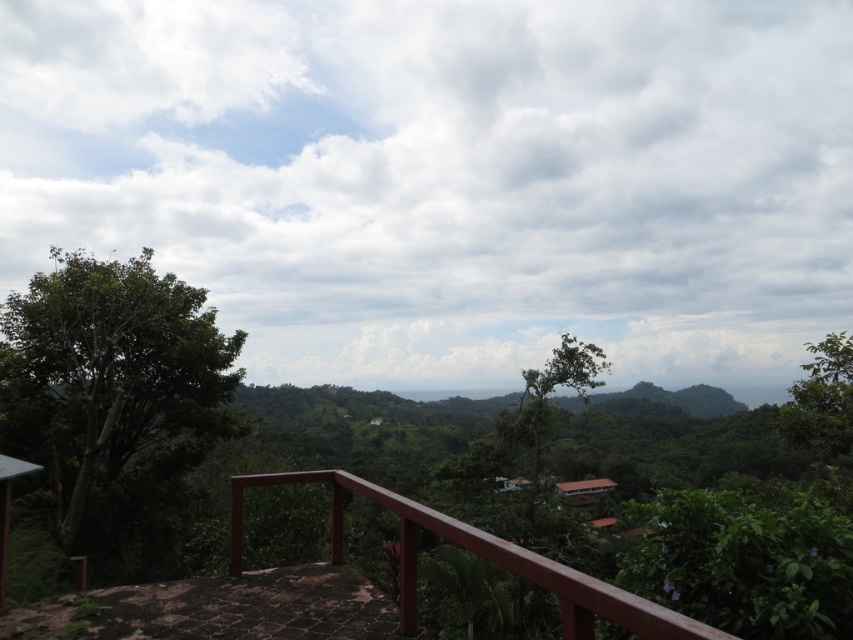
Question: Estimate the real-world distances between objects in this image. Which object is closer to the green leafy tree at center?

Choices:
 (A) green leafy tree at left
 (B) green leafy tree at right

Answer: (B)

Question: Does green leafy tree at right appear on the left side of green leafy tree at center?

Choices:
 (A) no
 (B) yes

Answer: (A)

Question: Is green leafy tree at left to the right of green leafy tree at right from the viewer's perspective?

Choices:
 (A) no
 (B) yes

Answer: (A)

Question: Which of the following is the farthest from the observer?

Choices:
 (A) green leafy tree at left
 (B) brown wooden railing at lower center
 (C) green leafy tree at right
 (D) green leafy tree at center

Answer: (D)

Question: Among these points, which one is nearest to the camera?

Choices:
 (A) (538, 433)
 (B) (91, 292)

Answer: (B)

Question: Does brown wooden railing at lower center appear on the right side of green leafy tree at center?

Choices:
 (A) no
 (B) yes

Answer: (A)